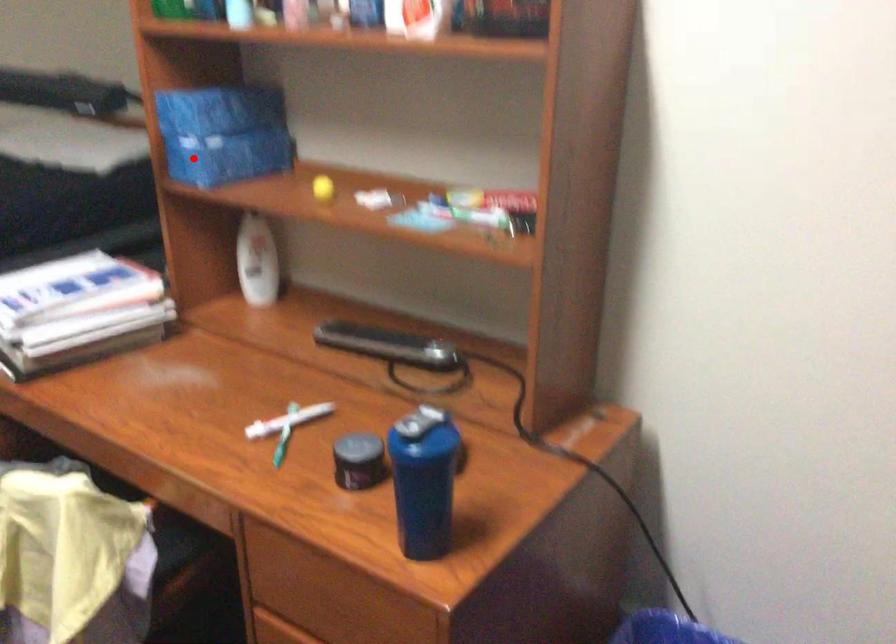
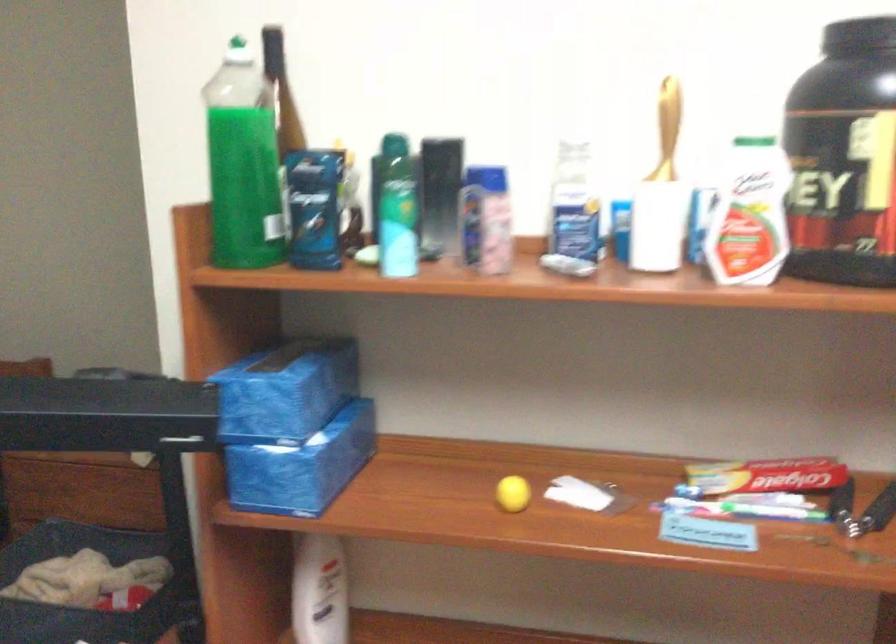
Question: I am providing you with two images of the same scene from different viewpoints. A red point is shown in image1. For the corresponding object point in image2, is it positioned nearer or farther from the camera?

Choices:
 (A) Nearer
 (B) Farther

Answer: (A)